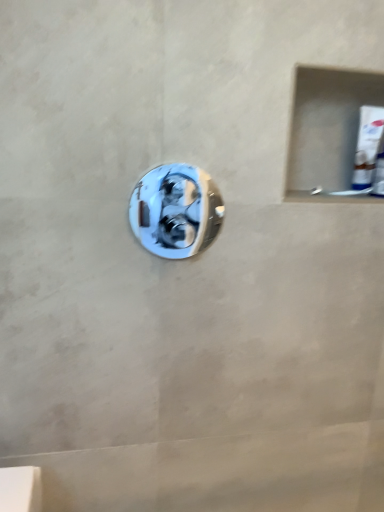
Question: In the image, is polished chrome door handle at center positioned in front of or behind white glossy tube at upper right?

Choices:
 (A) front
 (B) behind

Answer: (A)

Question: Visually, is polished chrome door handle at center positioned to the left or to the right of white glossy tube at upper right?

Choices:
 (A) left
 (B) right

Answer: (A)

Question: From a real-world perspective, is polished chrome door handle at center above or below white glossy tube at upper right?

Choices:
 (A) above
 (B) below

Answer: (B)

Question: In terms of height, does white glossy tube at upper right look taller or shorter compared to polished chrome door handle at center?

Choices:
 (A) short
 (B) tall

Answer: (A)

Question: Considering their positions, is white glossy tube at upper right located in front of or behind polished chrome door handle at center?

Choices:
 (A) front
 (B) behind

Answer: (B)

Question: Is white glossy tube at upper right spatially inside polished chrome door handle at center, or outside of it?

Choices:
 (A) outside
 (B) inside

Answer: (A)

Question: From the image's perspective, relative to polished chrome door handle at center, is white glossy tube at upper right above or below?

Choices:
 (A) above
 (B) below

Answer: (A)